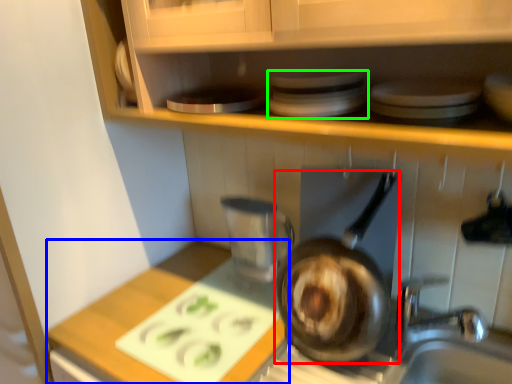
Question: Which is nearer to the frying pan (highlighted by a red box)? counter top (highlighted by a blue box) or appliance (highlighted by a green box).

Choices:
 (A) counter top
 (B) appliance

Answer: (A)